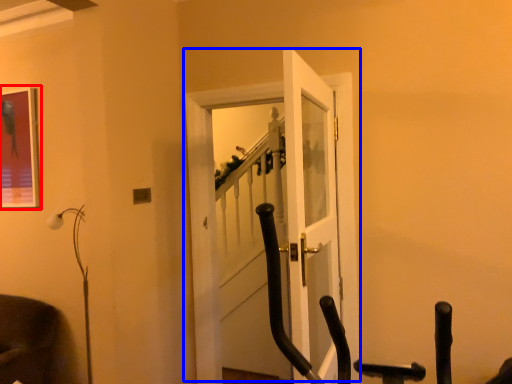
Question: Which of the following is the farthest to the observer, picture frame (highlighted by a red box) or door (highlighted by a blue box)?

Choices:
 (A) picture frame
 (B) door

Answer: (A)